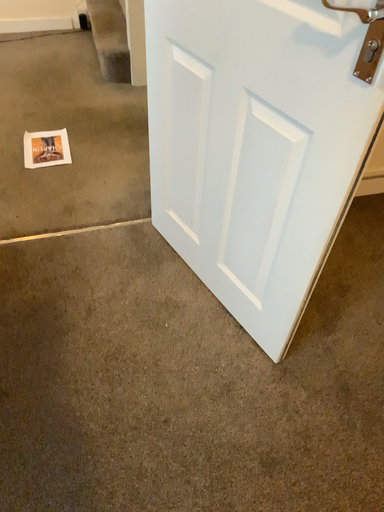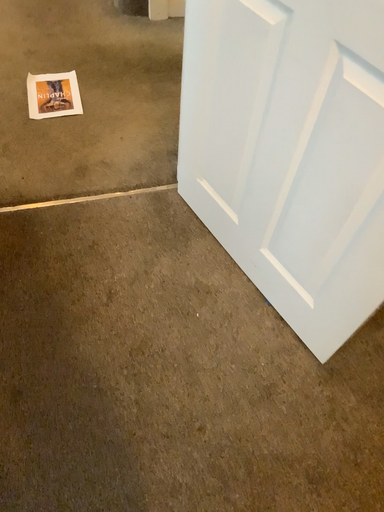
Question: Which way did the camera rotate in the video?

Choices:
 (A) rotated downward
 (B) rotated upward

Answer: (A)